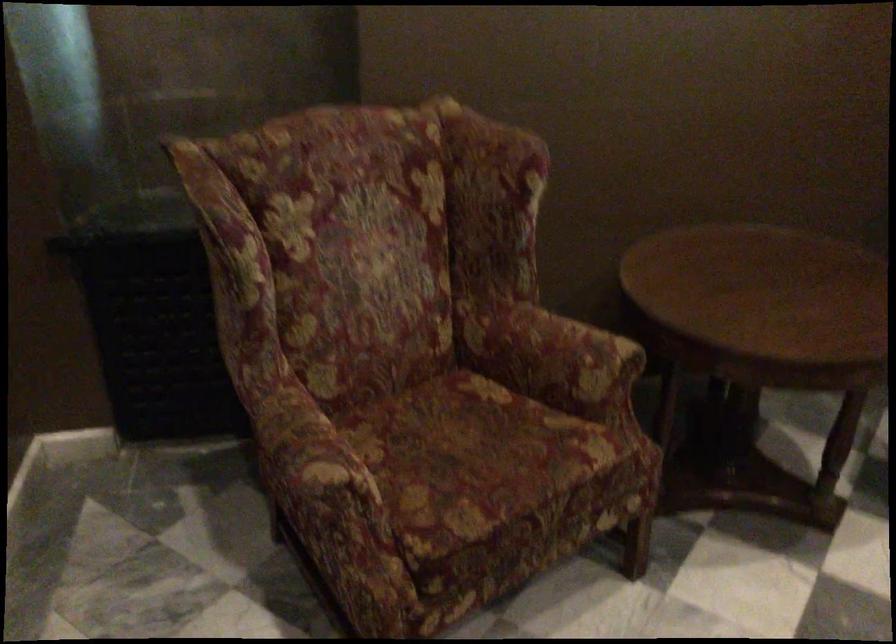
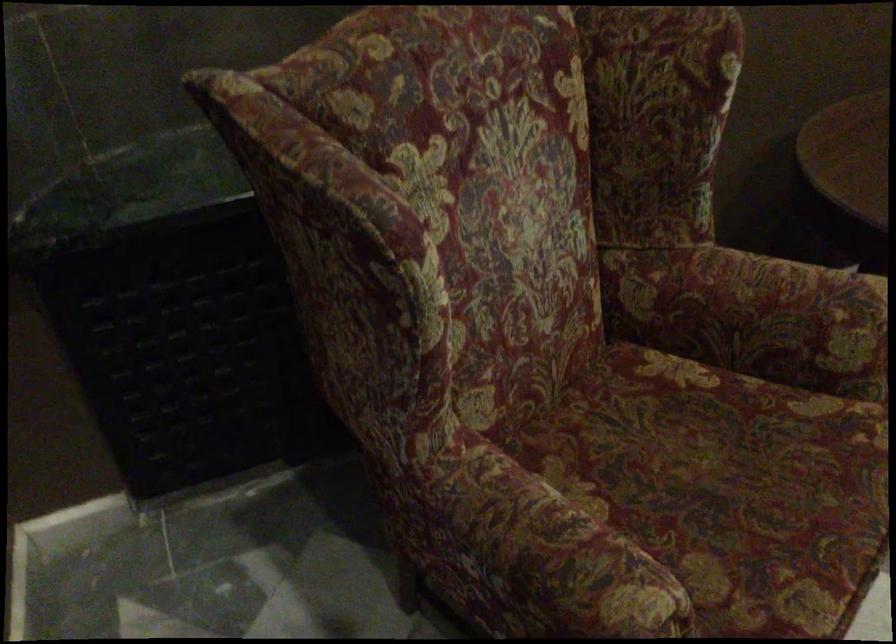
In a continuous first-person perspective shot, in which direction is the camera moving?

The cameraman walked toward left, forward.